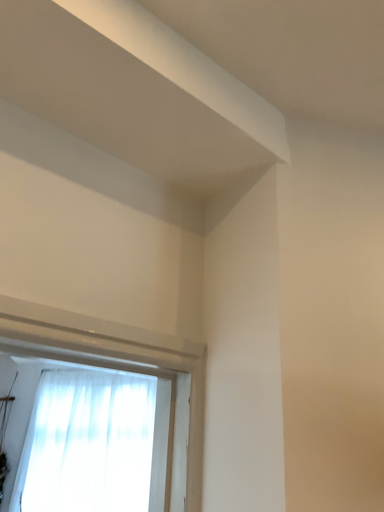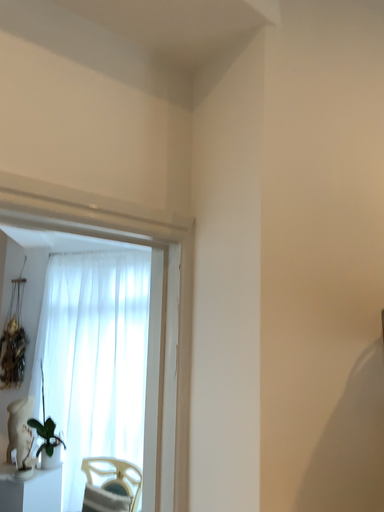
Question: How did the camera likely rotate when shooting the video?

Choices:
 (A) rotated upward
 (B) rotated downward

Answer: (B)